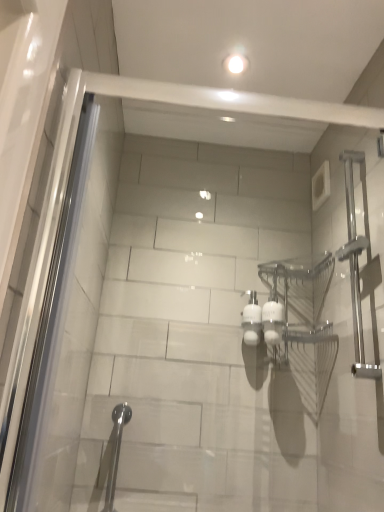
What do you see at coordinates (116, 451) in the screenshot? I see `satin nickel shower at lower left, the 1th shower positioned from the bottom` at bounding box center [116, 451].

Where is `satin nickel shower at lower left, placed as the 1th shower when sorted from left to right`? satin nickel shower at lower left, placed as the 1th shower when sorted from left to right is located at coordinates (116, 451).

Describe the element at coordinates (358, 268) in the screenshot. I see `satin nickel towel bar at right, which is the 1th shower from right to left` at that location.

Identify the location of satin nickel towel bar at right, the 1th shower when ordered from top to bottom. This screenshot has width=384, height=512. (358, 268).

You are a GUI agent. You are given a task and a screenshot of the screen. Output one action in this format:
    pyautogui.click(x=<x>, y=<y>)
    Task: Click on the satin nickel shower at lower left, which is counted as the second shower, starting from the top
    
    Given the screenshot: What is the action you would take?
    pyautogui.click(x=116, y=451)

Considering the relative positions of satin nickel towel bar at right, the 2th shower ordered from the bottom, and satin nickel shower at lower left, placed as the 1th shower when sorted from left to right, in the image provided, is satin nickel towel bar at right, the 2th shower ordered from the bottom, to the right of satin nickel shower at lower left, placed as the 1th shower when sorted from left to right, from the viewer's perspective?

Indeed, satin nickel towel bar at right, the 2th shower ordered from the bottom, is positioned on the right side of satin nickel shower at lower left, placed as the 1th shower when sorted from left to right.

In the scene shown: Relative to satin nickel shower at lower left, which is counted as the second shower, starting from the right, is satin nickel towel bar at right, which is the second shower from left to right, in front or behind?

Visually, satin nickel towel bar at right, which is the second shower from left to right, is located in front of satin nickel shower at lower left, which is counted as the second shower, starting from the right.

Which is in front, point (356, 327) or point (120, 441)?

The point (356, 327) is in front.

From the image's perspective, would you say satin nickel towel bar at right, the 2th shower ordered from the bottom, is positioned over satin nickel shower at lower left, placed as the 1th shower when sorted from left to right?

Correct, satin nickel towel bar at right, the 2th shower ordered from the bottom, appears higher than satin nickel shower at lower left, placed as the 1th shower when sorted from left to right, in the image.

From a real-world perspective, is satin nickel towel bar at right, which is the 1th shower from right to left, located beneath satin nickel shower at lower left, which is counted as the second shower, starting from the top?

No, from a real-world perspective, satin nickel towel bar at right, which is the 1th shower from right to left, is not beneath satin nickel shower at lower left, which is counted as the second shower, starting from the top.

Which object is thinner, satin nickel towel bar at right, which is the second shower from left to right, or satin nickel shower at lower left, placed as the 1th shower when sorted from left to right?

With smaller width is satin nickel shower at lower left, placed as the 1th shower when sorted from left to right.

Based on the photo, is satin nickel towel bar at right, which is the second shower from left to right, taller than satin nickel shower at lower left, the 1th shower positioned from the bottom?

Yes.

Between satin nickel towel bar at right, the 1th shower when ordered from top to bottom, and satin nickel shower at lower left, the 1th shower positioned from the bottom, which one has smaller size?

satin nickel shower at lower left, the 1th shower positioned from the bottom.

Is satin nickel towel bar at right, which is the second shower from left to right, positioned beyond the bounds of satin nickel shower at lower left, which is counted as the second shower, starting from the right?

Yes, satin nickel towel bar at right, which is the second shower from left to right, is not within satin nickel shower at lower left, which is counted as the second shower, starting from the right.

Are satin nickel towel bar at right, which is the 1th shower from right to left, and satin nickel shower at lower left, the 1th shower positioned from the bottom, making contact?

No, satin nickel towel bar at right, which is the 1th shower from right to left, is not in contact with satin nickel shower at lower left, the 1th shower positioned from the bottom.

Based on the photo, is satin nickel shower at lower left, placed as the 1th shower when sorted from left to right, at the back of satin nickel towel bar at right, which is the second shower from left to right?

No, satin nickel shower at lower left, placed as the 1th shower when sorted from left to right, is not at the back of satin nickel towel bar at right, which is the second shower from left to right.

In order to click on shower behind the satin nickel towel bar at right, which is the second shower from left to right in this screenshot , I will do pos(116,451).

Which object is positioned more to the left, satin nickel shower at lower left, placed as the 1th shower when sorted from left to right, or satin nickel towel bar at right, which is the 1th shower from right to left?

satin nickel shower at lower left, placed as the 1th shower when sorted from left to right.

Does satin nickel shower at lower left, the 1th shower positioned from the bottom, come in front of satin nickel towel bar at right, which is the second shower from left to right?

No, satin nickel shower at lower left, the 1th shower positioned from the bottom, is behind satin nickel towel bar at right, which is the second shower from left to right.

Which point is more forward, (117,457) or (354,375)?

The point (354,375) is closer.

From the image's perspective, is satin nickel shower at lower left, which is counted as the second shower, starting from the right, located beneath satin nickel towel bar at right, the 2th shower ordered from the bottom?

Yes, from the image's perspective, satin nickel shower at lower left, which is counted as the second shower, starting from the right, is beneath satin nickel towel bar at right, the 2th shower ordered from the bottom.

From a real-world perspective, does satin nickel shower at lower left, placed as the 1th shower when sorted from left to right, stand above satin nickel towel bar at right, the 1th shower when ordered from top to bottom?

No.

Which object is thinner, satin nickel shower at lower left, placed as the 1th shower when sorted from left to right, or satin nickel towel bar at right, which is the second shower from left to right?

satin nickel shower at lower left, placed as the 1th shower when sorted from left to right.

Does satin nickel shower at lower left, placed as the 1th shower when sorted from left to right, have a lesser height compared to satin nickel towel bar at right, which is the 1th shower from right to left?

Indeed, satin nickel shower at lower left, placed as the 1th shower when sorted from left to right, has a lesser height compared to satin nickel towel bar at right, which is the 1th shower from right to left.

Between satin nickel shower at lower left, placed as the 1th shower when sorted from left to right, and satin nickel towel bar at right, the 1th shower when ordered from top to bottom, which one has larger size?

satin nickel towel bar at right, the 1th shower when ordered from top to bottom, is bigger.

Is satin nickel shower at lower left, the 1th shower positioned from the bottom, completely or partially outside of satin nickel towel bar at right, the 2th shower ordered from the bottom?

Yes.

Can you see satin nickel shower at lower left, which is counted as the second shower, starting from the top, touching satin nickel towel bar at right, which is the second shower from left to right?

satin nickel shower at lower left, which is counted as the second shower, starting from the top, is not next to satin nickel towel bar at right, which is the second shower from left to right, and they're not touching.

Could you tell me if satin nickel shower at lower left, which is counted as the second shower, starting from the top, is turned towards satin nickel towel bar at right, which is the second shower from left to right?

No, satin nickel shower at lower left, which is counted as the second shower, starting from the top, is not facing towards satin nickel towel bar at right, which is the second shower from left to right.

At what (x,y) coordinates should I click in order to perform the action: click on shower above the satin nickel shower at lower left, which is counted as the second shower, starting from the top (from a real-world perspective). Please return your answer as a coordinate pair (x, y). This screenshot has height=512, width=384. Looking at the image, I should click on click(x=358, y=268).

Find the location of a particular element. shower above the satin nickel shower at lower left, which is counted as the second shower, starting from the right (from a real-world perspective) is located at coordinates pos(358,268).

The image size is (384, 512). What are the coordinates of `shower above the satin nickel shower at lower left, which is counted as the second shower, starting from the top (from the image's perspective)` in the screenshot? It's located at (358, 268).